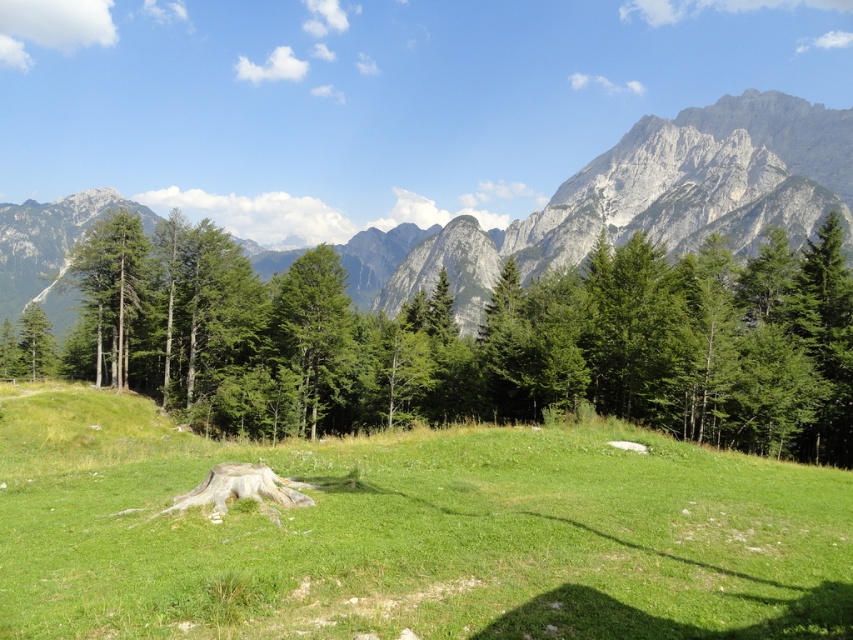
Looking at this image, you are standing in the meadow and want to walk towards the dense forest of coniferous trees. There are two points marked in the image, point 1 at coordinates point (238, 525) and point 2 at coordinates point (221, 339). Which point should you head towards to reach the forest more quickly?

Point 1 at coordinates point (238, 525) is closer to the viewer than point 2 at coordinates point (221, 339). Since you want to reach the forest quickly, you should head towards the point that is closer to you, which is point (238, 525).

Based on the scene description provided, where is the green leafy tree at center located in terms of coordinates?

The green leafy tree at center is located at coordinates point (467, 340).

You are a hiker standing at the edge of the green grassy field at center and looking towards the green leafy tree at center. Which direction should you walk to reach the tree?

The green grassy field at center is located below the green leafy tree at center, so you should walk upwards to reach the tree.